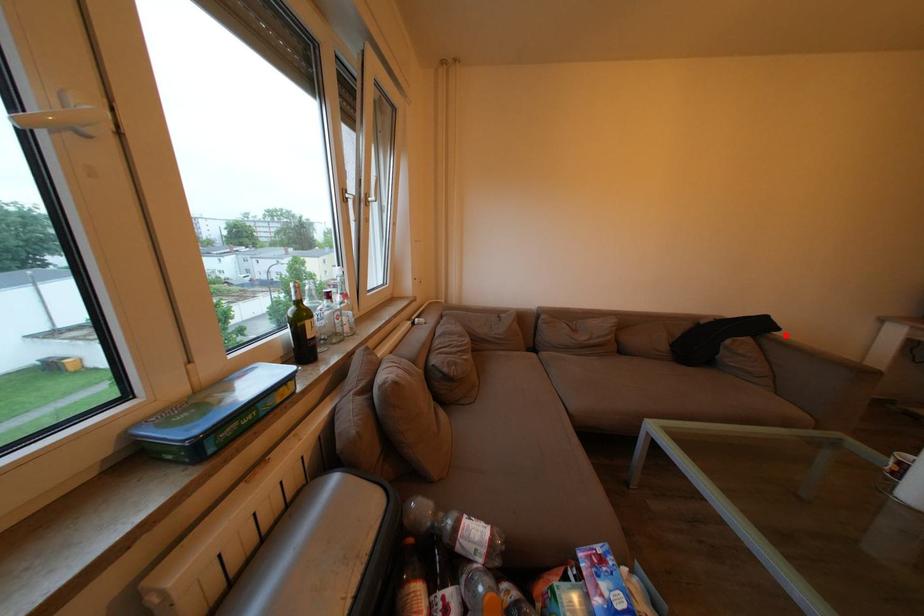
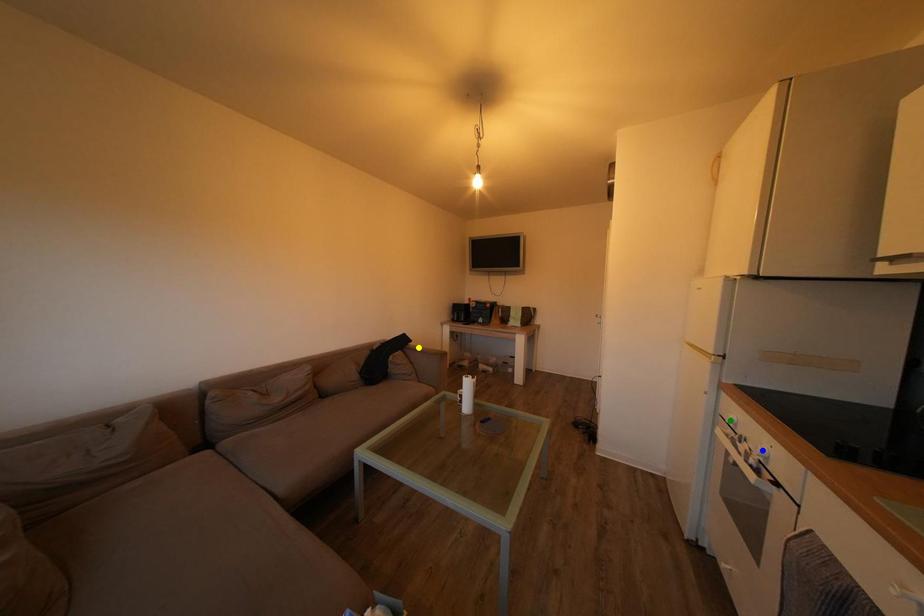
Question: I am providing you with two images of the same scene from different viewpoints. A red point is marked on the first image. You are given multiple points on the second image. Which point in image 2 represents the same 3d spot as the red point in image 1?

Choices:
 (A) green point
 (B) yellow point
 (C) blue point

Answer: (B)